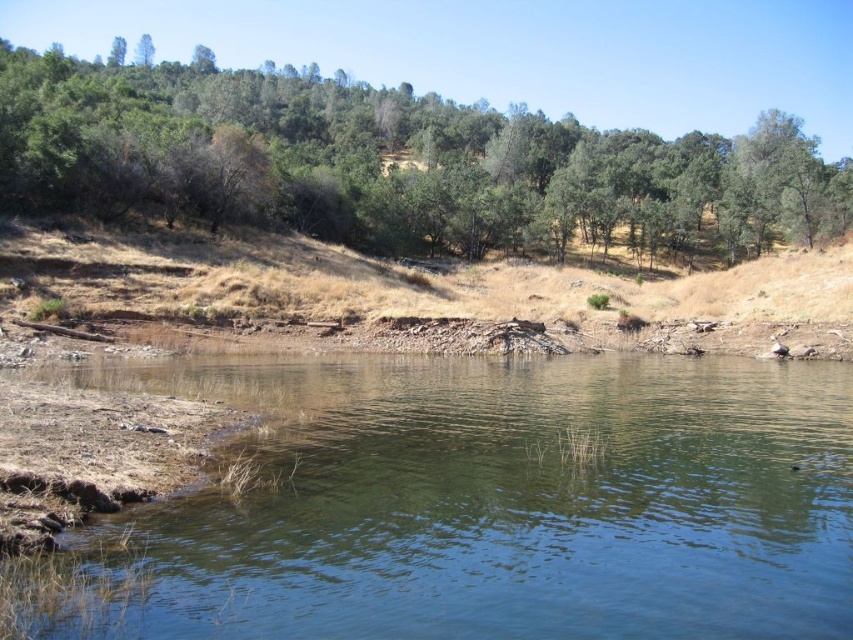
Question: Among these points, which one is farthest from the camera?

Choices:
 (A) (292, 116)
 (B) (670, 305)
 (C) (523, 436)

Answer: (A)

Question: Is clear water at center smaller than green leafy tree at upper center?

Choices:
 (A) no
 (B) yes

Answer: (B)

Question: Can you confirm if clear water at center is thinner than brown dirt at center?

Choices:
 (A) no
 (B) yes

Answer: (B)

Question: Which object is positioned closest to the green leafy tree at upper center?

Choices:
 (A) brown dirt at center
 (B) clear water at center

Answer: (A)

Question: Can you confirm if clear water at center is positioned to the left of green leafy tree at upper center?

Choices:
 (A) no
 (B) yes

Answer: (A)

Question: Estimate the real-world distances between objects in this image. Which object is farther from the green leafy tree at upper center?

Choices:
 (A) clear water at center
 (B) brown dirt at center

Answer: (A)